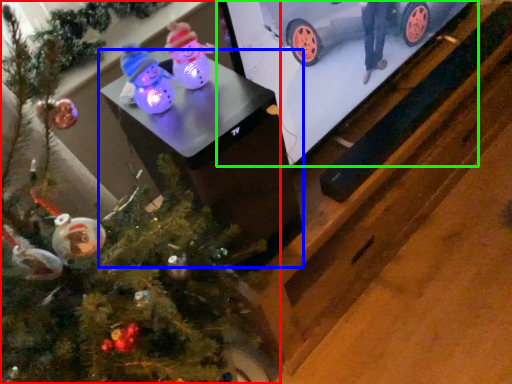
Question: Considering the real-world distances, which object is farthest from christmas tree (highlighted by a red box)? table (highlighted by a blue box) or tv show (highlighted by a green box)?

Choices:
 (A) table
 (B) tv show

Answer: (B)